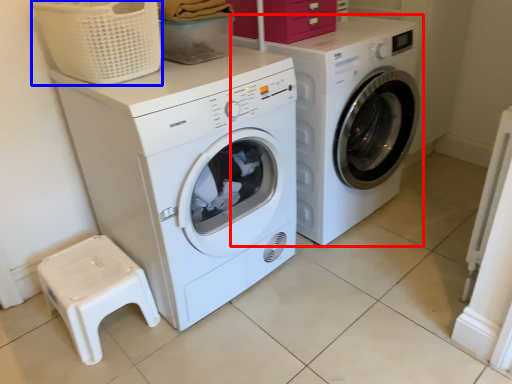
Question: Which object is closer to the camera taking this photo, washing machine (highlighted by a red box) or basket (highlighted by a blue box)?

Choices:
 (A) washing machine
 (B) basket

Answer: (B)